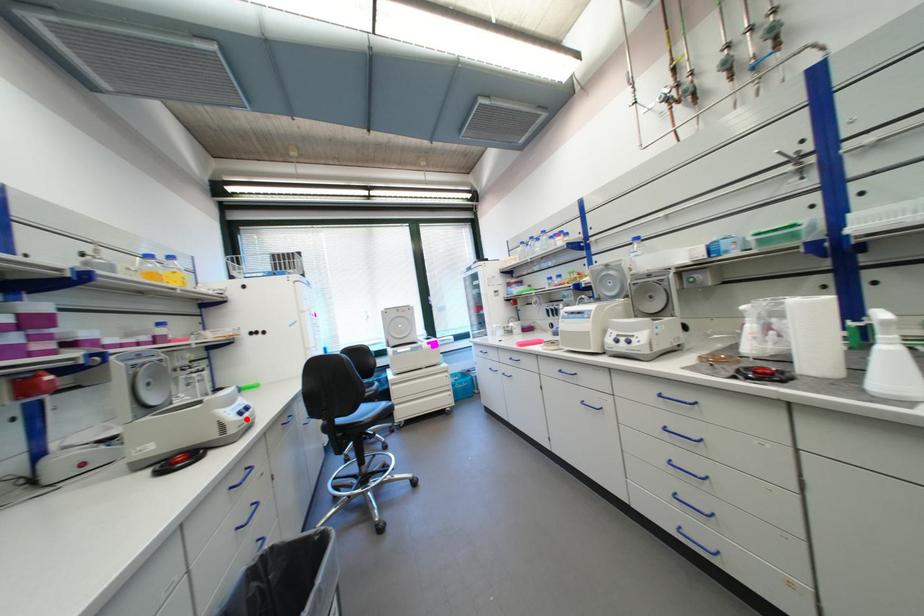
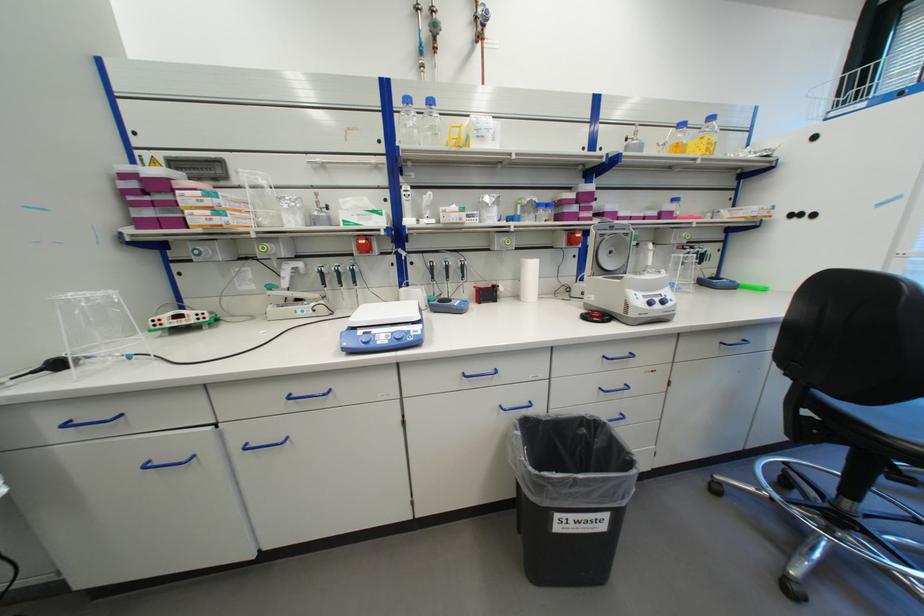
In the second image, find the point that corresponds to the highlighted location in the first image.

(652, 307)